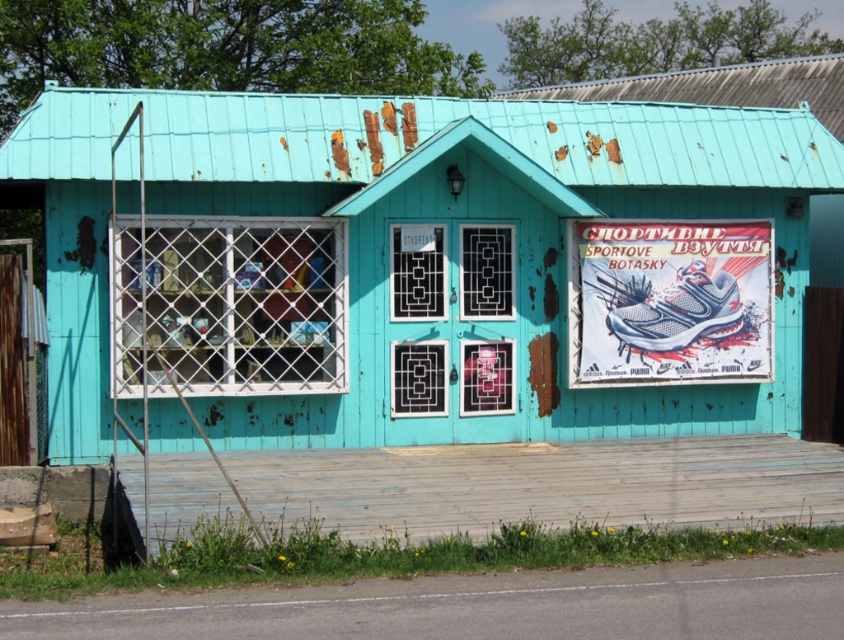
Is the position of teal wooden hut at center more distant than that of white paper poster at upper right?

That is False.

The height and width of the screenshot is (640, 844). What do you see at coordinates (414, 262) in the screenshot?
I see `teal wooden hut at center` at bounding box center [414, 262].

Identify the location of teal wooden hut at center. (414, 262).